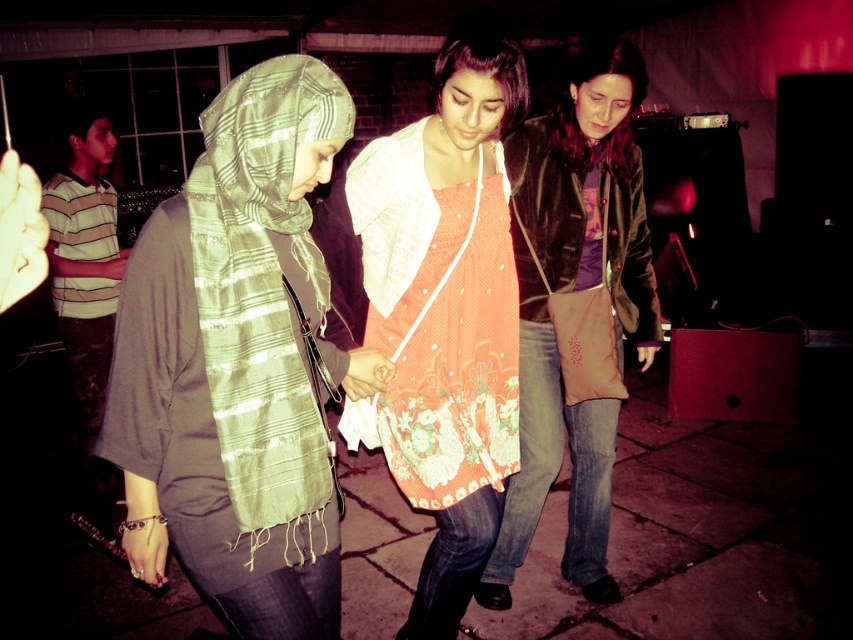
Which is in front, point (474, 282) or point (70, 179)?

Point (474, 282)

Does point (488, 384) come farther from viewer compared to point (93, 248)?

No, (488, 384) is in front of (93, 248).

Is point (444, 572) farther from viewer compared to point (96, 518)?

No, it is in front of (96, 518).

Where is `orange printed dress at center`? The width and height of the screenshot is (853, 640). orange printed dress at center is located at coordinates (451, 321).

Does green striped scarf at left have a lesser width compared to brown suede jacket at center?

Yes, green striped scarf at left is thinner than brown suede jacket at center.

Can you confirm if green striped scarf at left is positioned above brown suede jacket at center?

Indeed, green striped scarf at left is positioned over brown suede jacket at center.

This screenshot has height=640, width=853. In order to click on green striped scarf at left in this screenshot , I will do `click(264, 296)`.

Does point (422, 596) come farther from viewer compared to point (288, 83)?

Yes, it is behind point (288, 83).

Based on the photo, between orange printed dress at center and green striped scarf at left, which one appears on the left side from the viewer's perspective?

green striped scarf at left is more to the left.

Between point (408, 368) and point (248, 113), which one is positioned in front?

Positioned in front is point (248, 113).

This screenshot has height=640, width=853. In order to click on orange printed dress at center in this screenshot , I will do `click(451, 321)`.